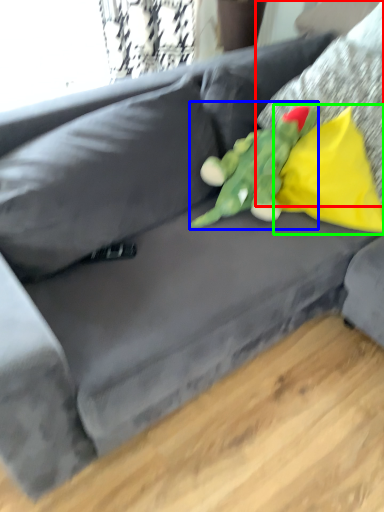
Question: Which is farther away from pillow (highlighted by a red box)? toy (highlighted by a blue box) or pillow (highlighted by a green box)?

Choices:
 (A) toy
 (B) pillow

Answer: (A)